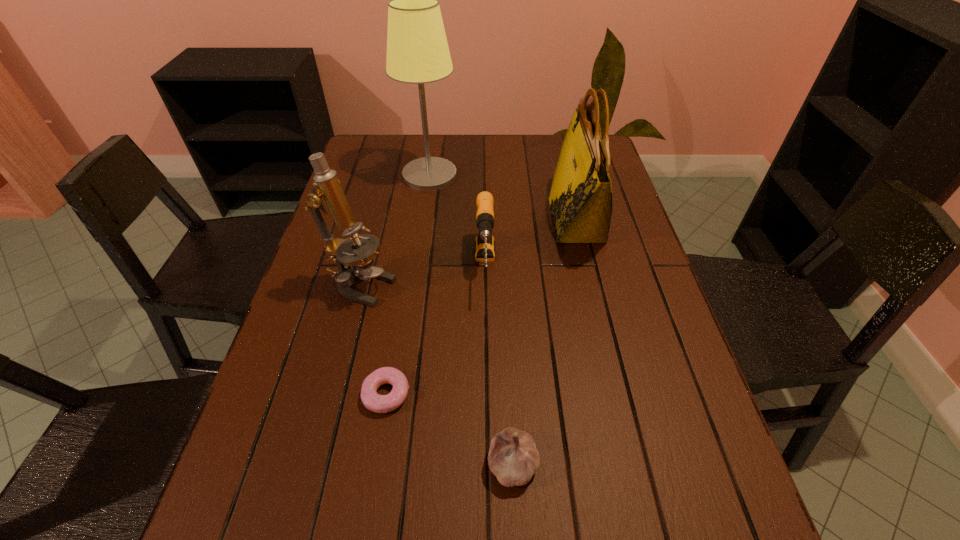
Locate an element on the screen. This screenshot has height=540, width=960. free spot between the tote bag and the tallest object is located at coordinates (503, 198).

Image resolution: width=960 pixels, height=540 pixels. I want to click on empty space between the tallest object and the drill, so 457,221.

Find the location of a particular element. The image size is (960, 540). object that ranks as the fifth closest to the fifth farthest object is located at coordinates (417, 49).

Identify which object is located as the fifth nearest to the tallest object. Please provide its 2D coordinates. Your answer should be formatted as a tuple, i.e. [(x, y)], where the tuple contains the x and y coordinates of a point satisfying the conditions above.

[(513, 458)]

This screenshot has height=540, width=960. What are the coordinates of `blank space that satisfies the following two spatial constraints: 1. on the front-facing side of the tote bag; 2. on the handle side of the drill` in the screenshot? It's located at point(588,267).

Locate an element on the screen. free space that satisfies the following two spatial constraints: 1. on the front side of the garlic; 2. on the right side of the microscope is located at coordinates (317, 463).